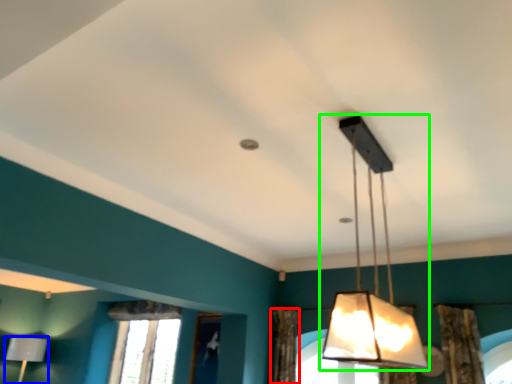
Question: Estimate the real-world distances between objects in this image. Which object is closer to curtain (highlighted by a red box), lamp (highlighted by a blue box) or lamp (highlighted by a green box)?

Choices:
 (A) lamp
 (B) lamp

Answer: (A)